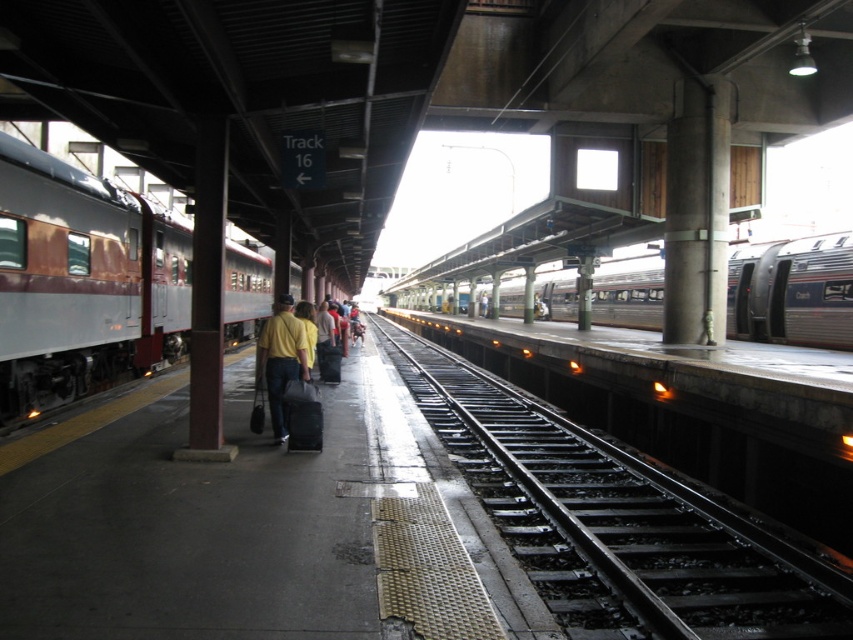
Question: Does rustic metal train at left lie behind silver metallic train at center?

Choices:
 (A) yes
 (B) no

Answer: (B)

Question: Which of the following is the farthest from the observer?

Choices:
 (A) (202, 536)
 (B) (273, 337)
 (C) (643, 296)

Answer: (C)

Question: Which of the following is the farthest from the observer?

Choices:
 (A) (99, 429)
 (B) (131, 307)
 (C) (283, 401)
 (D) (639, 305)

Answer: (D)

Question: Among these points, which one is nearest to the camera?

Choices:
 (A) (74, 376)
 (B) (195, 563)
 (C) (260, 336)
 (D) (509, 397)

Answer: (B)

Question: Is concrete platform at center to the right of silver metallic train at center from the viewer's perspective?

Choices:
 (A) yes
 (B) no

Answer: (B)

Question: Observing the image, what is the correct spatial positioning of rustic metal train at left in reference to silver metallic train at center?

Choices:
 (A) below
 (B) above

Answer: (B)